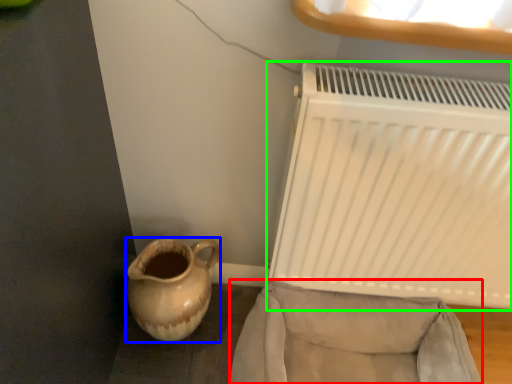
Question: Which object is the farthest from armchair (highlighted by a red box)? Choose among these: jug (highlighted by a blue box) or radiator (highlighted by a green box).

Choices:
 (A) jug
 (B) radiator

Answer: (A)